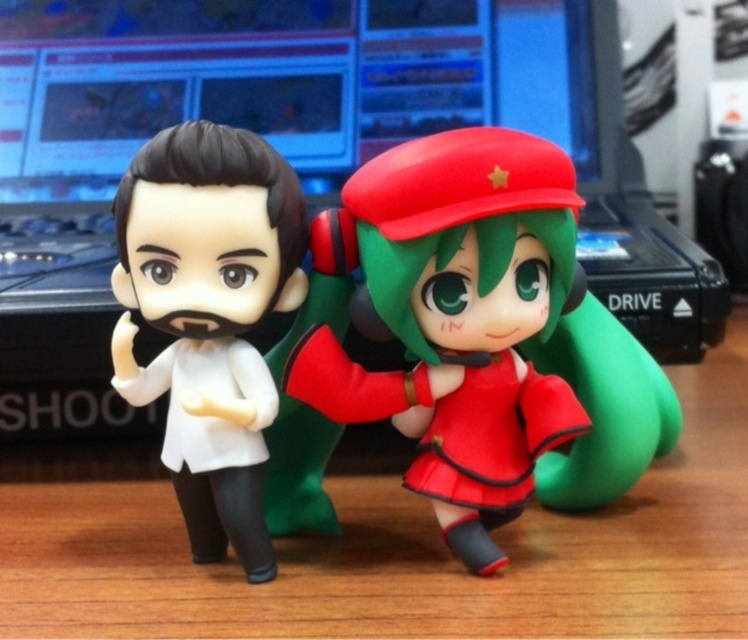
Between wooden table at center and rubberized red figure at center, which one appears on the right side from the viewer's perspective?

wooden table at center

Image resolution: width=748 pixels, height=640 pixels. What do you see at coordinates (387, 545) in the screenshot?
I see `wooden table at center` at bounding box center [387, 545].

Does point (684, 435) come farther from viewer compared to point (622, 358)?

Yes, it is behind point (622, 358).

The height and width of the screenshot is (640, 748). Find the location of `wooden table at center`. wooden table at center is located at coordinates [387, 545].

Who is positioned more to the left, rubberized red figure at center or white matte figure at left?

Positioned to the left is white matte figure at left.

Is rubberized red figure at center positioned in front of white matte figure at left?

Yes.

Where is `rubberized red figure at center`? rubberized red figure at center is located at coordinates (488, 337).

Identify the location of rubberized red figure at center. This screenshot has width=748, height=640. (488, 337).

Between wooden table at center and white matte figure at left, which one appears on the left side from the viewer's perspective?

white matte figure at left

Which is more to the right, wooden table at center or white matte figure at left?

From the viewer's perspective, wooden table at center appears more on the right side.

This screenshot has width=748, height=640. I want to click on wooden table at center, so click(387, 545).

Locate an element on the screen. wooden table at center is located at coordinates point(387,545).